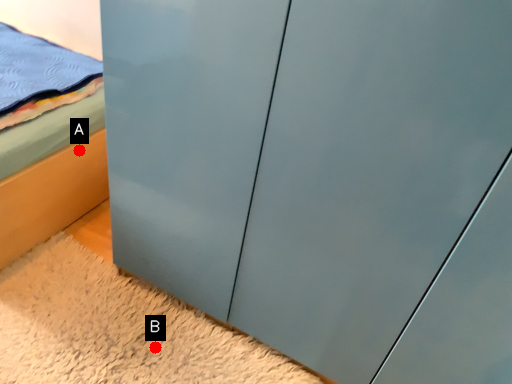
Question: Two points are circled on the image, labeled by A and B beside each circle. Which point appears farthest from the camera in this image?

Choices:
 (A) A is further
 (B) B is further

Answer: (A)